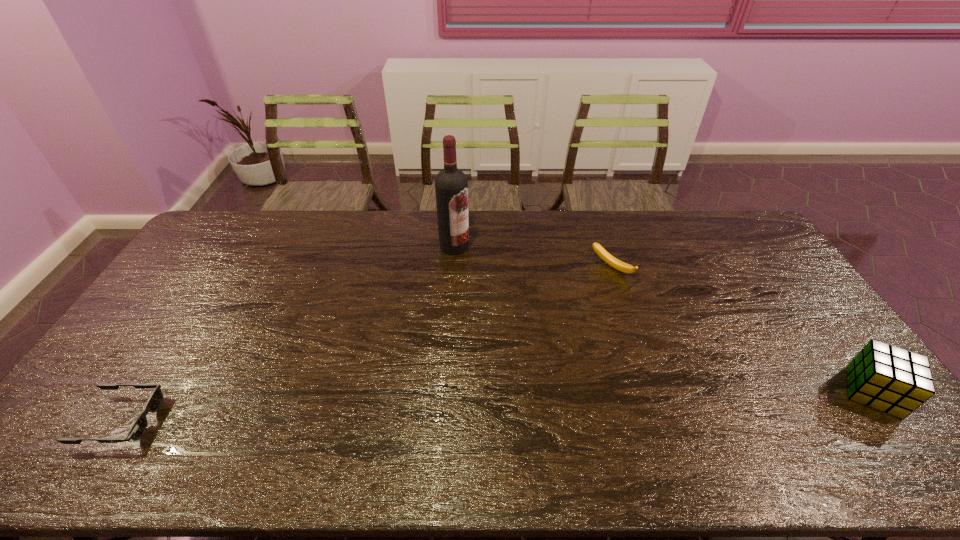
Where is `the leftmost object`? The image size is (960, 540). the leftmost object is located at coordinates (139, 427).

Locate an element on the screen. This screenshot has height=540, width=960. the shortest object is located at coordinates (139, 427).

Identify the location of the rightmost object. The image size is (960, 540). (887, 378).

Locate an element on the screen. cube is located at coordinates (887, 378).

What are the coordinates of `the third object from right to left` in the screenshot? It's located at (451, 186).

Find the location of a particular element. The width and height of the screenshot is (960, 540). wine bottle is located at coordinates (451, 186).

Identify the location of banana. (621, 266).

Where is `the second object from right to left`? the second object from right to left is located at coordinates (621, 266).

I want to click on vacant space located on the temples of the sunglasses, so click(x=199, y=420).

Where is `vacant position located on the back of the rightmost object`? This screenshot has width=960, height=540. vacant position located on the back of the rightmost object is located at coordinates (804, 299).